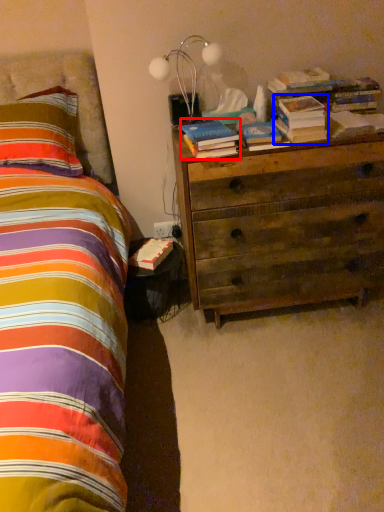
Question: Which point is closer to the camera, book (highlighted by a red box) or book (highlighted by a blue box)?

Choices:
 (A) book
 (B) book

Answer: (A)